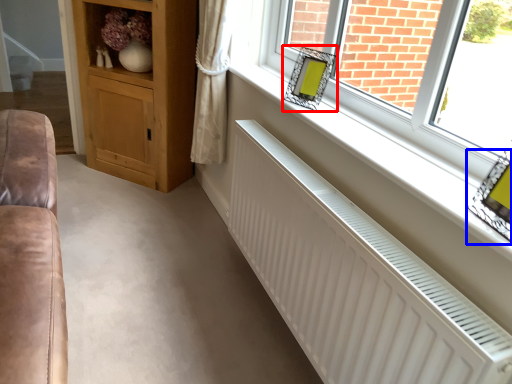
Question: Which of the following is the closest to the observer, picture frame (highlighted by a red box) or picture frame (highlighted by a blue box)?

Choices:
 (A) picture frame
 (B) picture frame

Answer: (B)